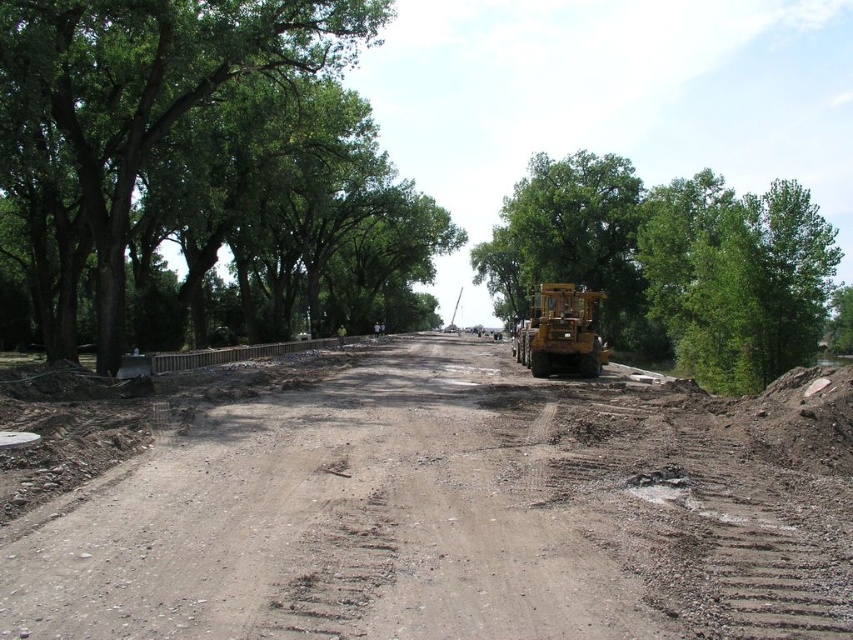
Question: Which point is closer to the camera taking this photo?

Choices:
 (A) (500, 294)
 (B) (277, 81)
 (C) (575, 300)
 (D) (550, 173)

Answer: (C)

Question: In this image, where is brown dirt track at center located relative to green leafy tree at center?

Choices:
 (A) below
 (B) above

Answer: (A)

Question: Among these objects, which one is nearest to the camera?

Choices:
 (A) green leafy tree at left
 (B) yellow rubber excavator at center
 (C) green leafy tree at center

Answer: (A)

Question: Is brown dirt track at center further to the viewer compared to yellow rubber excavator at center?

Choices:
 (A) yes
 (B) no

Answer: (B)

Question: Can you confirm if green leafy tree at right is smaller than green leafy tree at center?

Choices:
 (A) yes
 (B) no

Answer: (B)

Question: Which of the following is the farthest from the observer?

Choices:
 (A) (756, 612)
 (B) (289, 314)
 (C) (589, 314)
 (D) (608, 289)

Answer: (B)